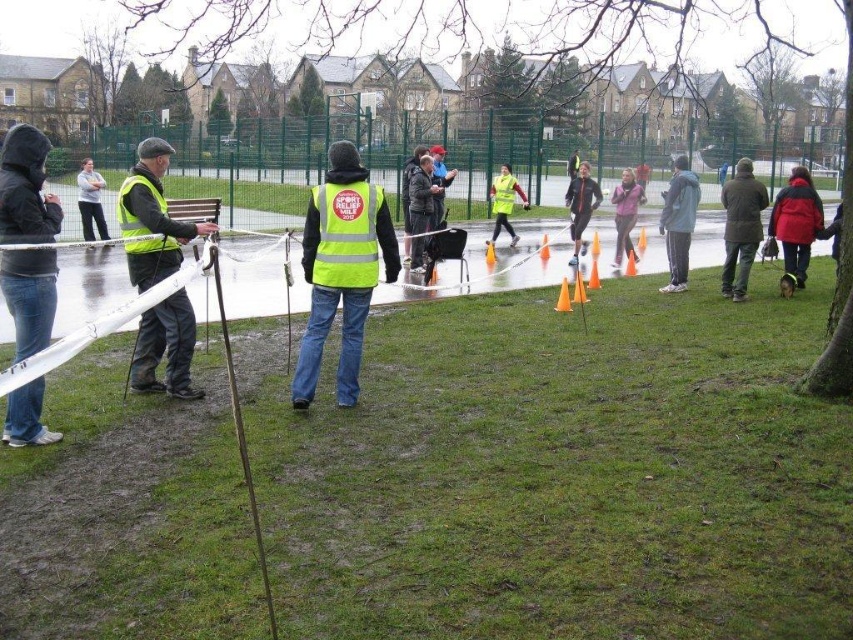
Which is behind, point (692, 179) or point (503, 189)?

The point (503, 189) is behind.

Find the location of a particular element. gray matte jacket at center is located at coordinates (677, 221).

Does point (677, 202) come behind point (517, 236)?

No, (677, 202) is closer to viewer.

The height and width of the screenshot is (640, 853). I want to click on gray matte jacket at center, so click(677, 221).

Can you confirm if neon yellow reflective vest at center is positioned below yellow reflective safety vest at center?

Yes.

Find the location of `neon yellow reflective vest at center`. neon yellow reflective vest at center is located at coordinates (341, 268).

Who is higher up, yellow reflective safety vest at center or orange plastic cone at center?

yellow reflective safety vest at center

Can you confirm if yellow reflective safety vest at center is positioned below orange plastic cone at center?

Incorrect, yellow reflective safety vest at center is not positioned below orange plastic cone at center.

Is point (509, 198) behind point (560, 291)?

Yes.

Where is `yellow reflective safety vest at center`? This screenshot has width=853, height=640. yellow reflective safety vest at center is located at coordinates (503, 193).